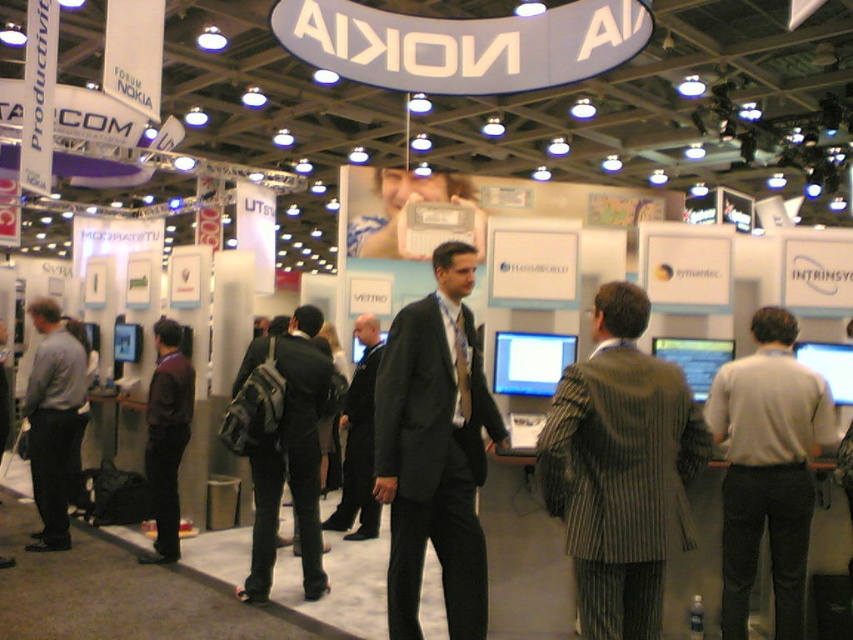
You are an event organizer at the Nokia booth and need to decide which item to move first. Since the striped wool suit at center is smaller than the dark gray backpack at center, which item can be moved more easily through the narrow aisles between booths?

The striped wool suit at center can be moved more easily through the narrow aisles between booths because it is smaller than the dark gray backpack at center.

You are an attendee at the Nokia booth and want to approach the person wearing the dark gray suit at center. Which direction should you move relative to the black suit at center?

The dark gray suit at center is to the right of the black suit at center, so you should move to the right side of the black suit at center to approach the person in the dark gray suit at center.